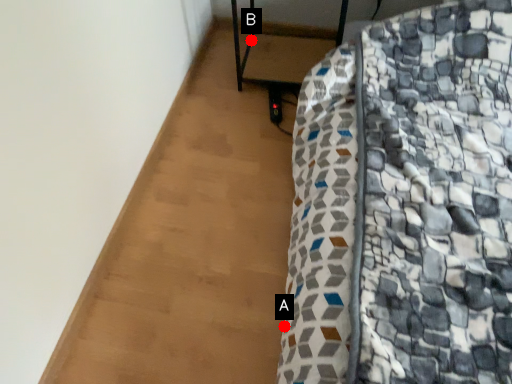
Question: Two points are circled on the image, labeled by A and B beside each circle. Which point is farther to the camera?

Choices:
 (A) A is further
 (B) B is further

Answer: (B)